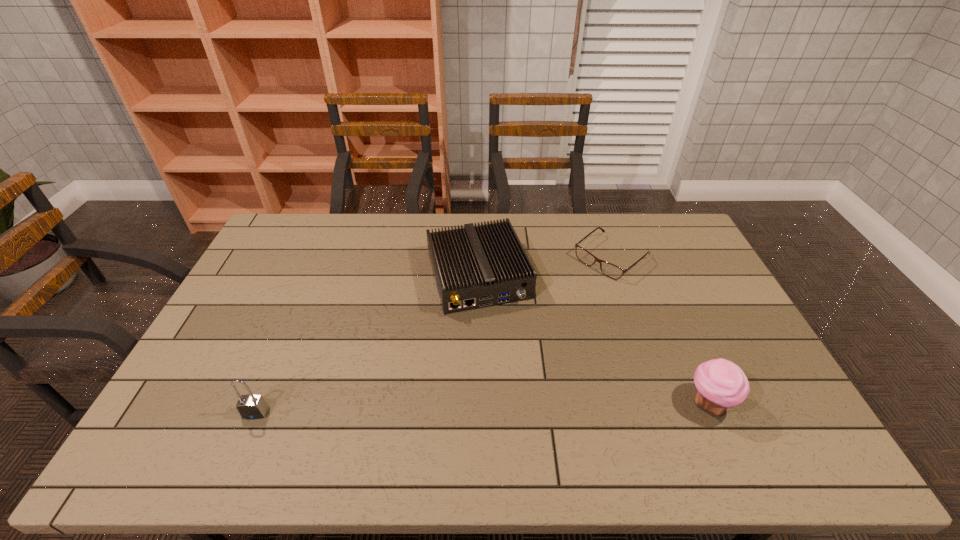
The height and width of the screenshot is (540, 960). I want to click on free space that is in between the cupcake and the second shortest object, so click(x=593, y=340).

Locate an element on the screen. the third closest object relative to the router is located at coordinates (250, 406).

Locate which object ranks third in proximity to the padlock. Please provide its 2D coordinates. Your answer should be formatted as a tuple, i.e. [(x, y)], where the tuple contains the x and y coordinates of a point satisfying the conditions above.

[(721, 384)]